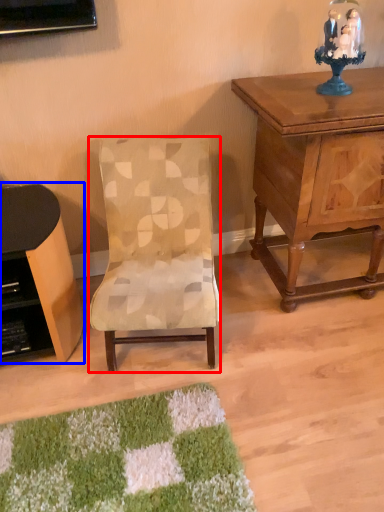
Question: Which point is closer to the camera, chair (highlighted by a red box) or desk (highlighted by a blue box)?

Choices:
 (A) chair
 (B) desk

Answer: (A)